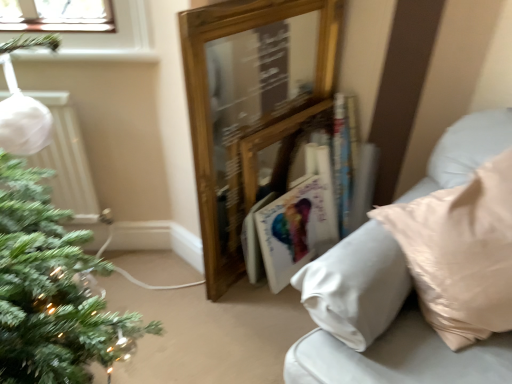
Question: Could you tell me if white matte radiator at left is facing hardcover book at center?

Choices:
 (A) yes
 (B) no

Answer: (B)

Question: Is white matte radiator at left at the right side of hardcover book at center?

Choices:
 (A) no
 (B) yes

Answer: (A)

Question: Can you see white matte radiator at left touching hardcover book at center?

Choices:
 (A) yes
 (B) no

Answer: (B)

Question: Is white matte radiator at left looking in the opposite direction of hardcover book at center?

Choices:
 (A) yes
 (B) no

Answer: (B)

Question: Can you confirm if white matte radiator at left is shorter than hardcover book at center?

Choices:
 (A) no
 (B) yes

Answer: (B)

Question: Looking at their shapes, would you say hardcover book at center is wider or thinner than white matte radiator at left?

Choices:
 (A) thin
 (B) wide

Answer: (B)

Question: Is hardcover book at center taller or shorter than white matte radiator at left?

Choices:
 (A) tall
 (B) short

Answer: (A)

Question: Is hardcover book at center inside or outside of white matte radiator at left?

Choices:
 (A) outside
 (B) inside

Answer: (A)

Question: Visually, is hardcover book at center positioned to the left or to the right of white matte radiator at left?

Choices:
 (A) left
 (B) right

Answer: (B)

Question: Is white satin pillow at right wider or thinner than white glossy magazine at center?

Choices:
 (A) thin
 (B) wide

Answer: (B)

Question: In terms of size, does white satin pillow at right appear bigger or smaller than white glossy magazine at center?

Choices:
 (A) small
 (B) big

Answer: (B)

Question: From a real-world perspective, is white satin pillow at right positioned above or below white glossy magazine at center?

Choices:
 (A) below
 (B) above

Answer: (B)

Question: From the image's perspective, is white satin pillow at right above or below white glossy magazine at center?

Choices:
 (A) above
 (B) below

Answer: (A)

Question: From a real-world perspective, is white matte radiator at left positioned above or below white glossy magazine at center?

Choices:
 (A) below
 (B) above

Answer: (B)

Question: Is white matte radiator at left wider or thinner than white glossy magazine at center?

Choices:
 (A) thin
 (B) wide

Answer: (A)